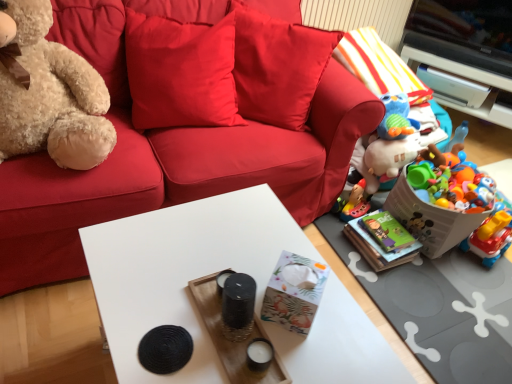
I want to click on free space to the back side of black woven coaster at lower center, the 3th toy when ordered from right to left, so click(177, 279).